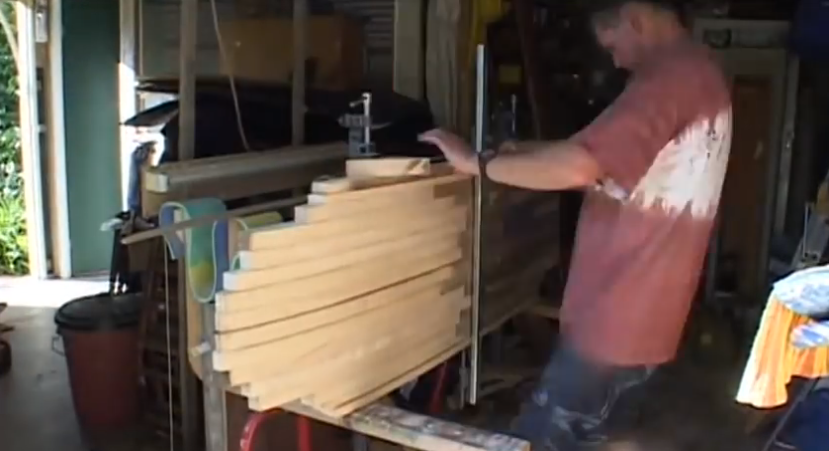
At what (x,y) coordinates should I click in order to perform the action: click on floor. Please return your answer as a coordinate pair (x, y). This screenshot has height=451, width=829. Looking at the image, I should click on (35, 384).